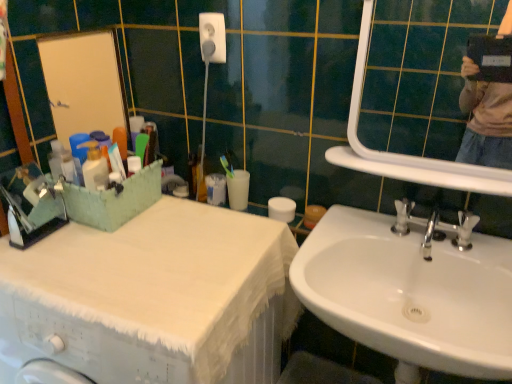
In order to face white fabric covered at left, should I rotate leftwards or rightwards?

To align with it, rotate left about 13.688°.

Find the location of `white glossy mirror at upper right`. white glossy mirror at upper right is located at coordinates (420, 74).

Does white matte toilet paper at center appear on the left side of white fabric covered at left?

Incorrect, white matte toilet paper at center is not on the left side of white fabric covered at left.

Between white matte toilet paper at center and white fabric covered at left, which one has more height?

white fabric covered at left.

Considering the points (238, 188) and (124, 267), which point is in front, point (238, 188) or point (124, 267)?

The point (124, 267) is closer.

Considering the sizes of objects white glossy mirror at upper right and white fabric covered at left in the image provided, who is wider, white glossy mirror at upper right or white fabric covered at left?

Wider between the two is white fabric covered at left.

Can you tell me how much white glossy mirror at upper right and white fabric covered at left differ in facing direction?

0.493 degrees separate the facing orientations of white glossy mirror at upper right and white fabric covered at left.

From a real-world perspective, is white glossy mirror at upper right physically located above or below white fabric covered at left?

Clearly, from a real-world perspective, white glossy mirror at upper right is above white fabric covered at left.

Which is more to the left, white glossy mirror at upper right or white fabric covered at left?

white fabric covered at left is more to the left.

Does point (246, 231) come in front of point (428, 3)?

No, (246, 231) is further to viewer.

Is white fabric covered at left bigger or smaller than white glossy mirror at upper right?

In the image, white fabric covered at left appears to be larger than white glossy mirror at upper right.

From the image's perspective, which is above, white fabric covered at left or white glossy mirror at upper right?

white glossy mirror at upper right appears higher in the image.

Who is taller, white fabric covered at left or white glossy mirror at upper right?

white fabric covered at left.

In terms of width, does white matte toilet paper at center look wider or thinner when compared to white glossy sink at lower right?

Clearly, white matte toilet paper at center has less width compared to white glossy sink at lower right.

From a real-world perspective, which object stands above the other?

white matte toilet paper at center.

Who is smaller, white matte toilet paper at center or white glossy sink at lower right?

white matte toilet paper at center is smaller.

Measure the distance from white fabric covered at left to white glossy sink at lower right.

The distance of white fabric covered at left from white glossy sink at lower right is 12.47 inches.

Considering the relative positions of white fabric covered at left and white glossy sink at lower right in the image provided, is white fabric covered at left to the right of white glossy sink at lower right from the viewer's perspective?

In fact, white fabric covered at left is to the left of white glossy sink at lower right.

Does white fabric covered at left have a larger size compared to white glossy sink at lower right?

Correct, white fabric covered at left is larger in size than white glossy sink at lower right.

From the image's perspective, who appears lower, white fabric covered at left or white glossy sink at lower right?

white fabric covered at left is shown below in the image.

Is white glossy mirror at upper right with white matte toilet paper at center?

No, white glossy mirror at upper right is not with white matte toilet paper at center.

Which object is positioned more to the left, white glossy mirror at upper right or white matte toilet paper at center?

From the viewer's perspective, white matte toilet paper at center appears more on the left side.

Is white glossy mirror at upper right completely or partially outside of white matte toilet paper at center?

Yes, white glossy mirror at upper right is located beyond the bounds of white matte toilet paper at center.

Is white matte toilet paper at center far away from white glossy mirror at upper right?

white matte toilet paper at center is positioned a significant distance from white glossy mirror at upper right.

Between point (245, 191) and point (359, 122), which one is positioned in front?

Point (245, 191)

Can you confirm if white matte toilet paper at center is thinner than white glossy mirror at upper right?

No.

This screenshot has width=512, height=384. Find the location of `toilet paper that is above the white fabric covered at left (from the image's perspective)`. toilet paper that is above the white fabric covered at left (from the image's perspective) is located at coordinates (238, 189).

This screenshot has height=384, width=512. In order to click on counter top that appears on the left of white glossy mirror at upper right in this screenshot , I will do `click(147, 293)`.

Looking at the image, which one is located closer to white fabric covered at left, white matte toilet paper at center or white glossy sink at lower right?

white glossy sink at lower right is positioned closer to the anchor white fabric covered at left.

When comparing their distances from white matte toilet paper at center, does white fabric covered at left or white glossy mirror at upper right seem closer?

white fabric covered at left is closer to white matte toilet paper at center.

Considering their positions, is white glossy mirror at upper right positioned closer to white fabric covered at left than white matte toilet paper at center?

white matte toilet paper at center is positioned closer to the anchor white fabric covered at left.

Estimate the real-world distances between objects in this image. Which object is closer to white matte toilet paper at center, white glossy sink at lower right or white fabric covered at left?

Based on the image, white fabric covered at left appears to be nearer to white matte toilet paper at center.

Which object lies nearer to the anchor point white glossy sink at lower right, white fabric covered at left or white matte toilet paper at center?

white fabric covered at left is closer to white glossy sink at lower right.

When comparing their distances from white glossy mirror at upper right, does white glossy sink at lower right or white fabric covered at left seem closer?

white glossy sink at lower right is positioned closer to the anchor white glossy mirror at upper right.

From the image, which object appears to be farther from white matte toilet paper at center, white glossy mirror at upper right or white glossy sink at lower right?

white glossy mirror at upper right lies further to white matte toilet paper at center than the other object.

Which object lies further to the anchor point white matte toilet paper at center, white fabric covered at left or white glossy sink at lower right?

The object further to white matte toilet paper at center is white glossy sink at lower right.

At what (x,y) coordinates should I click in order to perform the action: click on toilet paper between white glossy mirror at upper right and white fabric covered at left from top to bottom. Please return your answer as a coordinate pair (x, y). This screenshot has width=512, height=384. Looking at the image, I should click on (238, 189).

At what (x,y) coordinates should I click in order to perform the action: click on sink between white fabric covered at left and white glossy mirror at upper right. Please return your answer as a coordinate pair (x, y). The width and height of the screenshot is (512, 384). Looking at the image, I should click on (410, 294).

Locate an element on the screen. Image resolution: width=512 pixels, height=384 pixels. mirror positioned between white glossy sink at lower right and white matte toilet paper at center from near to far is located at coordinates (420, 74).

Find the location of a particular element. The image size is (512, 384). counter top between white glossy sink at lower right and white matte toilet paper at center in the front-back direction is located at coordinates (147, 293).